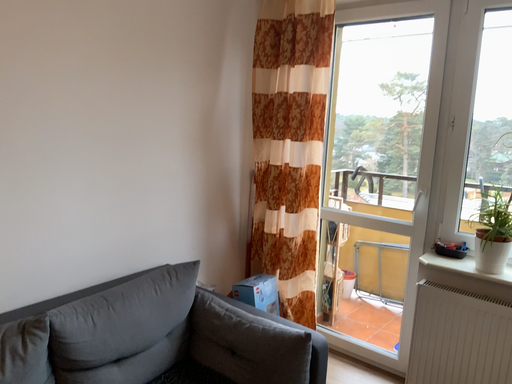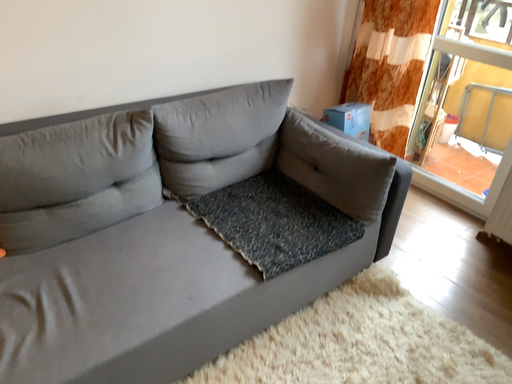
Question: How did the camera likely rotate when shooting the video?

Choices:
 (A) rotated upward
 (B) rotated downward

Answer: (B)